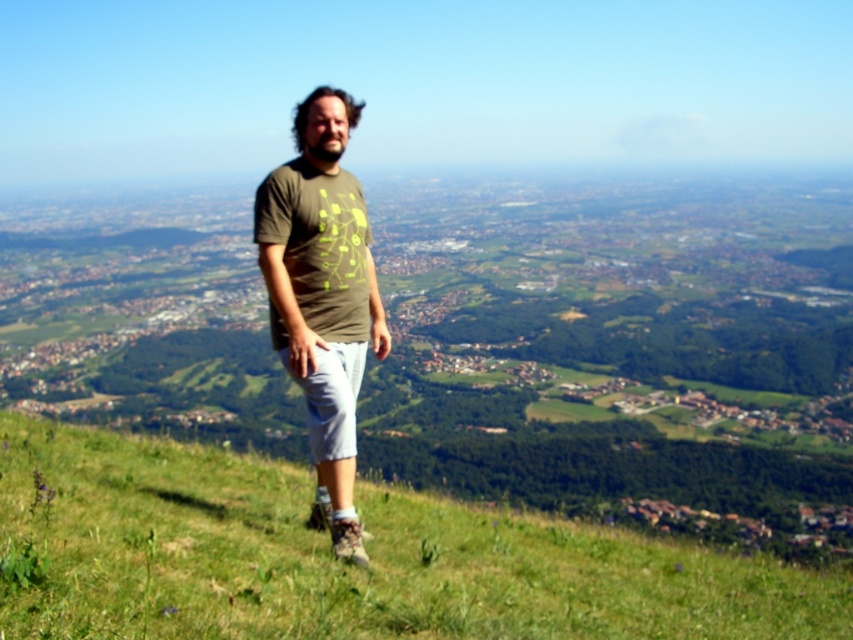
Between point (91, 548) and point (358, 250), which one is positioned in front?

Positioned in front is point (91, 548).

Does green grassy at center have a lesser height compared to matte green t-shirt at center?

Correct, green grassy at center is not as tall as matte green t-shirt at center.

Which is behind, point (587, 529) or point (358, 280)?

Point (587, 529)

Identify the location of green grassy at center. The width and height of the screenshot is (853, 640). (341, 563).